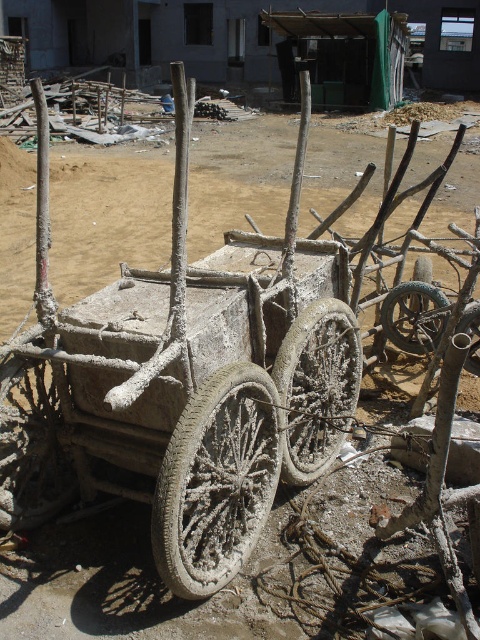
Who is lower down, gray textured wheel at center or gray concrete wheel at center?

gray textured wheel at center is lower down.

Which is in front, point (199, 525) or point (320, 300)?

Point (199, 525)

Between point (214, 534) and point (288, 403), which one is positioned behind?

The point (288, 403) is more distant.

Identify the location of gray textured wheel at center. (216, 481).

Is gray textured wheel at center thinner than gray concrete tire at center?

Incorrect, gray textured wheel at center's width is not less than gray concrete tire at center's.

How much distance is there between gray textured wheel at center and gray concrete tire at center?

gray textured wheel at center is 5.56 feet from gray concrete tire at center.

Image resolution: width=480 pixels, height=640 pixels. I want to click on gray textured wheel at center, so click(216, 481).

You are a GUI agent. You are given a task and a screenshot of the screen. Output one action in this format:
    pyautogui.click(x=<x>, y=<y>)
    Task: Click on the gray textured wheel at center
    
    Given the screenshot: What is the action you would take?
    pyautogui.click(x=216, y=481)

Is white dusty wheel at center to the left of rusty metal wheel at center from the viewer's perspective?

Correct, you'll find white dusty wheel at center to the left of rusty metal wheel at center.

Is white dusty wheel at center wider than rusty metal wheel at center?

Incorrect, white dusty wheel at center's width does not surpass rusty metal wheel at center's.

Is point (52, 493) positioned after point (386, 333)?

No.

Find the location of a particular element. white dusty wheel at center is located at coordinates (31, 445).